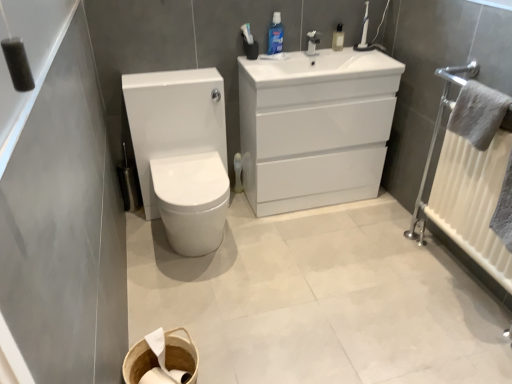
The width and height of the screenshot is (512, 384). In order to click on white glossy toilet at left in this screenshot , I will do click(x=181, y=153).

Describe the element at coordinates (181, 153) in the screenshot. I see `white glossy toilet at left` at that location.

You are a GUI agent. You are given a task and a screenshot of the screen. Output one action in this format:
    pyautogui.click(x=<x>, y=<y>)
    Task: Click on the matte white faucet at upper center
    Image resolution: width=512 pixels, height=384 pixels.
    Given the screenshot: What is the action you would take?
    pyautogui.click(x=312, y=42)

In order to face white glossy sink at upper center, should I rotate leftwards or rightwards?

Rotate your view right by about 9.082°.

At what (x,y) coordinates should I click in order to perform the action: click on white glossy sink at upper center. Please return your answer as a coordinate pair (x, y). The image size is (512, 384). Looking at the image, I should click on (321, 77).

Locate an element on the screen. white glossy cabinet at upper center is located at coordinates (315, 127).

Is blue glossy mouthwash at upper center, which is the second mouthwash from left to right, bigger or smaller than white plastic radiator at right?

Considering their sizes, blue glossy mouthwash at upper center, which is the second mouthwash from left to right, takes up less space than white plastic radiator at right.

Consider the image. Can you confirm if blue glossy mouthwash at upper center, which is the second mouthwash from left to right, is wider than white plastic radiator at right?

No, blue glossy mouthwash at upper center, which is the second mouthwash from left to right, is not wider than white plastic radiator at right.

From their relative heights in the image, would you say blue glossy mouthwash at upper center, which is the second mouthwash from left to right, is taller or shorter than white plastic radiator at right?

Clearly, blue glossy mouthwash at upper center, which is the second mouthwash from left to right, is shorter compared to white plastic radiator at right.

Based on the photo, which object is positioned more to the left, blue glossy mouthwash at upper center, which is the second mouthwash from left to right, or white plastic radiator at right?

Positioned to the left is blue glossy mouthwash at upper center, which is the second mouthwash from left to right.

Can we say blue glossy mouthwash at upper center, the 2th mouthwash positioned from the right, lies outside white glossy cabinet at upper center?

Yes, blue glossy mouthwash at upper center, the 2th mouthwash positioned from the right, is outside of white glossy cabinet at upper center.

From the image's perspective, which mouthwash is the 1st one above the white glossy cabinet at upper center? Please provide its 2D coordinates.

[(275, 35)]

Is blue glossy mouthwash at upper center, the 2th mouthwash positioned from the right, far from white glossy cabinet at upper center?

No, blue glossy mouthwash at upper center, the 2th mouthwash positioned from the right, is in close proximity to white glossy cabinet at upper center.

Is point (278, 27) farther from camera compared to point (243, 106)?

No, (278, 27) is closer to viewer.

Would you say white plastic radiator at right is part of matte white faucet at upper center's contents?

No, matte white faucet at upper center does not contain white plastic radiator at right.

Which object is positioned more to the left, matte white faucet at upper center or white plastic radiator at right?

Positioned to the left is matte white faucet at upper center.

Looking at this image, which is behind, matte white faucet at upper center or white plastic radiator at right?

matte white faucet at upper center is further away from the camera.

Where is `tap lying behind the white plastic radiator at right`? This screenshot has width=512, height=384. tap lying behind the white plastic radiator at right is located at coordinates (312, 42).

Is point (162, 328) more distant than point (472, 242)?

That is False.

Is white woven basket at lower center facing away from white plastic radiator at right?

No, white woven basket at lower center is not facing the opposite direction of white plastic radiator at right.

Could white plastic radiator at right be considered to be inside white woven basket at lower center?

That's incorrect, white plastic radiator at right is not inside white woven basket at lower center.

Considering the relative sizes of white woven basket at lower center and white plastic radiator at right in the image provided, is white woven basket at lower center thinner than white plastic radiator at right?

Indeed, white woven basket at lower center has a lesser width compared to white plastic radiator at right.

Looking at their sizes, would you say white glossy cabinet at upper center is wider or thinner than white glossy toilet at left?

In the image, white glossy cabinet at upper center appears to be more narrow than white glossy toilet at left.

Considering the relative sizes of white glossy cabinet at upper center and white glossy toilet at left in the image provided, is white glossy cabinet at upper center smaller than white glossy toilet at left?

Yes.

Considering their positions, is white glossy cabinet at upper center located in front of or behind white glossy toilet at left?

Visually, white glossy cabinet at upper center is located behind white glossy toilet at left.

From the image's perspective, which is above, white glossy cabinet at upper center or white glossy toilet at left?

white glossy cabinet at upper center, from the image's perspective.

Is white glossy toilet at left located outside gray fluffy towel at right?

white glossy toilet at left is positioned outside gray fluffy towel at right.

Is white glossy toilet at left in front of or behind gray fluffy towel at right in the image?

Visually, white glossy toilet at left is located behind gray fluffy towel at right.

I want to click on toilet behind the gray fluffy towel at right, so click(181, 153).

From a real-world perspective, who is located higher, white glossy toilet at left or gray fluffy towel at right?

gray fluffy towel at right.

Is white glossy sink at upper center beside white glossy cabinet at upper center?

white glossy sink at upper center is not next to white glossy cabinet at upper center, and they're not touching.

From the picture: Which is more to the right, white glossy sink at upper center or white glossy cabinet at upper center?

Positioned to the right is white glossy sink at upper center.

Is point (402, 66) closer or farther from the camera than point (285, 211)?

Point (402, 66) appears to be closer to the viewer than point (285, 211).

Identify the location of mouthwash that is the 2nd one when counting upward from the white plastic radiator at right (from the image's perspective). (338, 38).

The image size is (512, 384). I want to click on bathroom cabinet below the blue glossy mouthwash at upper center, which appears as the first mouthwash when viewed from the left (from a real-world perspective), so click(315, 127).

Considering their positions, is white glossy sink at upper center positioned further to white glossy cabinet at upper center than white woven basket at lower center?

white woven basket at lower center.

From the image, which object appears to be farther from matte white faucet at upper center, white woven basket at lower center or white glossy toilet at left?

white woven basket at lower center is positioned further to the anchor matte white faucet at upper center.

Looking at this image, which object lies further to the anchor point matte white faucet at upper center, gray fluffy towel at right or white plastic radiator at right?

Among the two, white plastic radiator at right is located further to matte white faucet at upper center.

Based on their spatial positions, is white glossy toilet at left or matte white faucet at upper center further from white glossy cabinet at upper center?

matte white faucet at upper center is positioned further to the anchor white glossy cabinet at upper center.

Looking at the image, which one is located further to blue glossy mouthwash at upper center, the 2th mouthwash positioned from the right, white glossy sink at upper center or matte white faucet at upper center?

The object further to blue glossy mouthwash at upper center, the 2th mouthwash positioned from the right, is white glossy sink at upper center.

Based on their spatial positions, is blue glossy mouthwash at upper center, which is the second mouthwash from left to right, or matte white faucet at upper center further from white plastic radiator at right?

matte white faucet at upper center.

From the picture: Which object lies nearer to the anchor point gray fluffy towel at right, white glossy toilet at left or white glossy cabinet at upper center?

Based on the image, white glossy cabinet at upper center appears to be nearer to gray fluffy towel at right.

Considering their positions, is blue glossy mouthwash at upper center, the 2th mouthwash positioned from the right, positioned further to white glossy toilet at left than white woven basket at lower center?

white woven basket at lower center.

Find the location of a particular element. Image resolution: width=512 pixels, height=384 pixels. mouthwash between white plastic radiator at right and matte white faucet at upper center from front to back is located at coordinates (275, 35).

Image resolution: width=512 pixels, height=384 pixels. Identify the location of bath towel positioned between white plastic radiator at right and white glossy sink at upper center from near to far. (478, 113).

The width and height of the screenshot is (512, 384). In order to click on counter top between white glossy toilet at left and blue glossy mouthwash at upper center, which is the first mouthwash in right-to-left order, in the horizontal direction in this screenshot , I will do `click(321, 77)`.

This screenshot has width=512, height=384. I want to click on toilet between blue glossy mouthwash at upper center, which is the first mouthwash in right-to-left order, and white woven basket at lower center vertically, so click(181, 153).